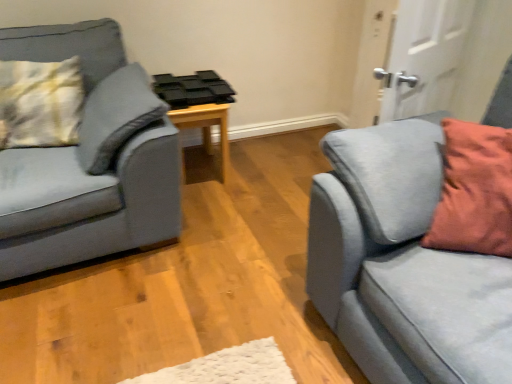
Question: Is yellow-green textured pillow at left positioned beyond the bounds of white matte door at upper right?

Choices:
 (A) yes
 (B) no

Answer: (A)

Question: Does yellow-green textured pillow at left have a lesser height compared to white matte door at upper right?

Choices:
 (A) no
 (B) yes

Answer: (B)

Question: Is white matte door at upper right at the back of yellow-green textured pillow at left?

Choices:
 (A) no
 (B) yes

Answer: (A)

Question: Does yellow-green textured pillow at left appear on the left side of white matte door at upper right?

Choices:
 (A) yes
 (B) no

Answer: (A)

Question: Considering the relative sizes of yellow-green textured pillow at left and white matte door at upper right in the image provided, is yellow-green textured pillow at left taller than white matte door at upper right?

Choices:
 (A) yes
 (B) no

Answer: (B)

Question: From their relative heights in the image, would you say yellow-green textured pillow at left is taller or shorter than suede gray couch at right, the 2th studio couch from the left?

Choices:
 (A) tall
 (B) short

Answer: (B)

Question: Considering the positions of yellow-green textured pillow at left and suede gray couch at right, the 2th studio couch from the left, in the image, is yellow-green textured pillow at left wider or thinner than suede gray couch at right, the 2th studio couch from the left,?

Choices:
 (A) wide
 (B) thin

Answer: (B)

Question: From the image's perspective, is yellow-green textured pillow at left above or below suede gray couch at right, which appears as the 1th studio couch when viewed from the right?

Choices:
 (A) above
 (B) below

Answer: (A)

Question: Looking at the image, does yellow-green textured pillow at left seem bigger or smaller compared to suede gray couch at right, the 2th studio couch from the left?

Choices:
 (A) small
 (B) big

Answer: (A)

Question: Is white matte door at upper right wider or thinner than yellow-green textured pillow at left?

Choices:
 (A) wide
 (B) thin

Answer: (B)

Question: Would you say white matte door at upper right is inside or outside yellow-green textured pillow at left?

Choices:
 (A) inside
 (B) outside

Answer: (B)

Question: Is white matte door at upper right bigger or smaller than yellow-green textured pillow at left?

Choices:
 (A) big
 (B) small

Answer: (B)

Question: Is white matte door at upper right in front of or behind yellow-green textured pillow at left in the image?

Choices:
 (A) behind
 (B) front

Answer: (B)

Question: Which is correct: white matte door at upper right is inside black plastic tray at center, or outside of it?

Choices:
 (A) inside
 (B) outside

Answer: (B)

Question: From the image's perspective, is white matte door at upper right positioned above or below black plastic tray at center?

Choices:
 (A) above
 (B) below

Answer: (A)